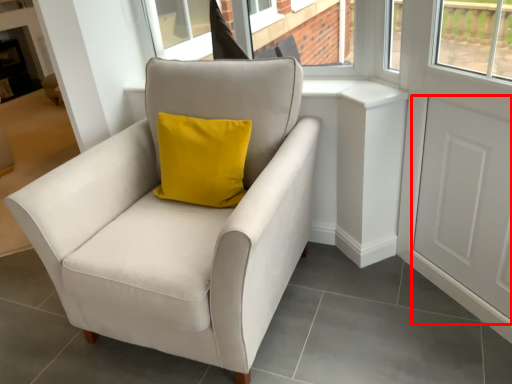
Question: From the image's perspective, where is screen door (annotated by the red box) located in relation to chair in the image?

Choices:
 (A) below
 (B) above

Answer: (B)